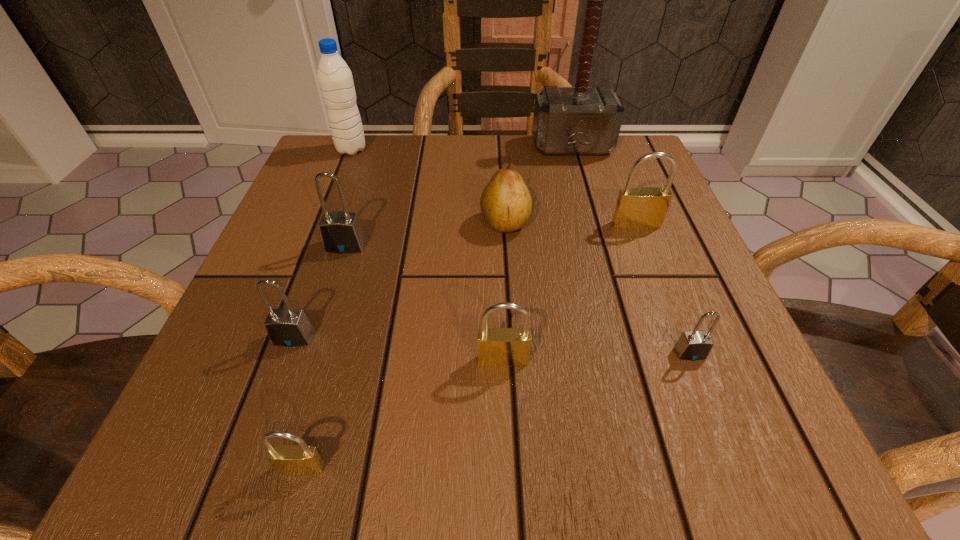
At what (x,y) coordinates should I click in order to perform the action: click on brown hammer. Please return your answer as a coordinate pair (x, y). Looking at the image, I should click on (581, 120).

Locate an element on the screen. Image resolution: width=960 pixels, height=540 pixels. the tallest object is located at coordinates coord(581,120).

Identify the location of the second tallest object. (335, 79).

You are a GUI agent. You are given a task and a screenshot of the screen. Output one action in this format:
    pyautogui.click(x=<x>, y=<y>)
    Task: Click on the gray water bottle
    The width and height of the screenshot is (960, 540).
    Given the screenshot: What is the action you would take?
    pyautogui.click(x=335, y=79)

Find the location of `the biggest gray padlock`. the biggest gray padlock is located at coordinates (341, 232).

Locate an element on the screen. The width and height of the screenshot is (960, 540). the second farthest padlock is located at coordinates (341, 232).

The image size is (960, 540). In order to click on the biggest brass padlock in this screenshot , I will do `click(637, 207)`.

Identify the location of the rightmost brass padlock. (637, 207).

Locate an element on the screen. This screenshot has width=960, height=540. pear is located at coordinates (506, 203).

This screenshot has width=960, height=540. I want to click on the second biggest gray padlock, so click(288, 327).